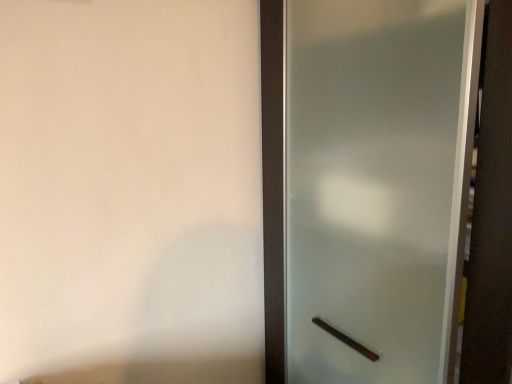
Describe the element at coordinates (377, 185) in the screenshot. I see `frosted glass barn door at right` at that location.

What is the approximate width of frosted glass barn door at right?

frosted glass barn door at right is 16.68 inches wide.

Locate an element on the screen. frosted glass barn door at right is located at coordinates tap(377, 185).

In the scene shown: In order to face frosted glass barn door at right, should I rotate leftwards or rightwards?

You should look right and rotate roughly 19.138 degrees.

Where is `frosted glass barn door at right`? frosted glass barn door at right is located at coordinates (377, 185).